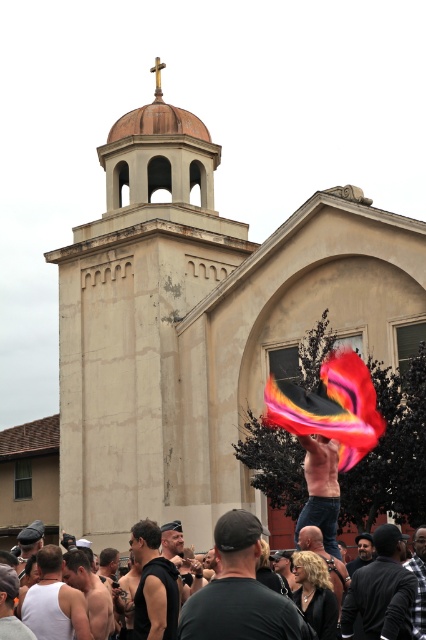
You are a photographer at the event and want to capture both the black leather jacket at center and the shiny black jacket at center in a single frame. Which jacket should you focus on to ensure both are visible without zooming in too much?

The black leather jacket at center has a smaller size compared to shiny black jacket at center. To ensure both are visible without zooming in too much, focus on the shiny black jacket at center since it is larger and will be easier to frame while keeping the smaller black leather jacket at center in the shot.

You are a photographer standing in front of the beige building with the dome roof. You want to take a photo of both the black leather jacket at center and the shiny black jacket at center in the same frame. The camera you are using has a maximum focus range of 2.5 meters. Will both jackets be in focus?

The distance between the black leather jacket at center and shiny black jacket at center is 2.63 meters, which exceeds the camera maximum focus range of 2.5 meters. Therefore, both jackets cannot be in focus at the same time.